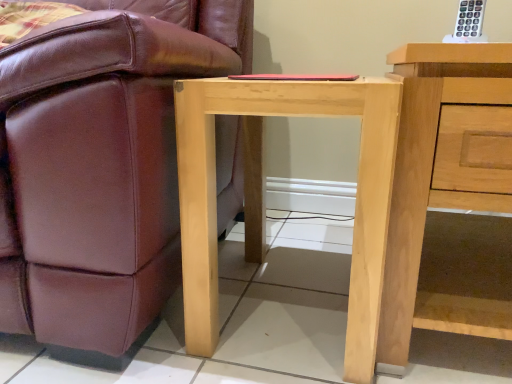
At what (x,y) coordinates should I click in order to perform the action: click on matte brown leather chair at lower left. Please return your answer as a coordinate pair (x, y). Image resolution: width=512 pixels, height=384 pixels. Looking at the image, I should click on (101, 168).

In the scene shown: Considering the relative positions of matte brown leather chair at lower left and natural wood table at center in the image provided, is matte brown leather chair at lower left to the left of natural wood table at center from the viewer's perspective?

Yes.

Considering the relative sizes of matte brown leather chair at lower left and natural wood table at center in the image provided, is matte brown leather chair at lower left bigger than natural wood table at center?

Indeed, matte brown leather chair at lower left has a larger size compared to natural wood table at center.

Is natural wood table at center inside matte brown leather chair at lower left?

No, matte brown leather chair at lower left does not contain natural wood table at center.

Locate an element on the screen. chair above the natural wood table at center (from a real-world perspective) is located at coordinates (101, 168).

Is matte brown leather chair at lower left in contact with natural wood nightstand at right?

They are not placed beside each other.

Is matte brown leather chair at lower left aimed at natural wood nightstand at right?

No, matte brown leather chair at lower left does not turn towards natural wood nightstand at right.

Can natural wood nightstand at right be found inside matte brown leather chair at lower left?

Actually, natural wood nightstand at right is outside matte brown leather chair at lower left.

Between matte brown leather chair at lower left and natural wood nightstand at right, which one has smaller size?

natural wood nightstand at right.

Considering the relative sizes of natural wood table at center and matte brown leather chair at lower left in the image provided, is natural wood table at center taller than matte brown leather chair at lower left?

Incorrect, the height of natural wood table at center is not larger of that of matte brown leather chair at lower left.

From a real-world perspective, is natural wood table at center positioned over matte brown leather chair at lower left based on gravity?

Incorrect, from a real-world perspective, natural wood table at center is lower than matte brown leather chair at lower left.

Can you confirm if natural wood table at center is positioned to the left of matte brown leather chair at lower left?

In fact, natural wood table at center is to the right of matte brown leather chair at lower left.

The image size is (512, 384). In order to click on desk that appears below the matte brown leather chair at lower left (from a real-world perspective) in this screenshot , I will do `click(262, 195)`.

What's the angular difference between natural wood nightstand at right and natural wood table at center's facing directions?

The angle between the facing direction of natural wood nightstand at right and the facing direction of natural wood table at center is 1.08 degrees.

Which point is more forward, [388,301] or [192,120]?

The point [192,120] is closer to the camera.

Is natural wood nightstand at right spatially inside natural wood table at center, or outside of it?

natural wood nightstand at right is not inside natural wood table at center, it's outside.

Is natural wood nightstand at right positioned with its back to natural wood table at center?

No, natural wood table at center is not at the back of natural wood nightstand at right.

Does natural wood table at center have a greater width compared to natural wood nightstand at right?

No, natural wood table at center is not wider than natural wood nightstand at right.

Which is farther, (x=198, y=81) or (x=428, y=169)?

The point (x=198, y=81) is farther.

In terms of size, does natural wood table at center appear bigger or smaller than natural wood nightstand at right?

In the image, natural wood table at center appears to be smaller than natural wood nightstand at right.

From the image's perspective, which is below, natural wood table at center or natural wood nightstand at right?

From the image's view, natural wood table at center is below.

Does point (406, 203) come farther from viewer compared to point (93, 338)?

No, (406, 203) is closer to viewer.

Is natural wood nightstand at right not close to matte brown leather chair at lower left?

No, natural wood nightstand at right is in close proximity to matte brown leather chair at lower left.

Who is taller, natural wood nightstand at right or matte brown leather chair at lower left?

matte brown leather chair at lower left is taller.

Which is in front, natural wood nightstand at right or matte brown leather chair at lower left?

Positioned in front is matte brown leather chair at lower left.

Find the location of a particular element. The image size is (512, 384). chair on the left of natural wood table at center is located at coordinates (101, 168).

Where is `chair that appears in front of the natural wood nightstand at right`? The image size is (512, 384). chair that appears in front of the natural wood nightstand at right is located at coordinates (101, 168).

Looking at the image, which one is located closer to natural wood table at center, natural wood nightstand at right or matte brown leather chair at lower left?

natural wood nightstand at right is positioned closer to the anchor natural wood table at center.

Which object lies nearer to the anchor point matte brown leather chair at lower left, natural wood nightstand at right or natural wood table at center?

Among the two, natural wood table at center is located nearer to matte brown leather chair at lower left.

Based on their spatial positions, is natural wood table at center or matte brown leather chair at lower left closer to natural wood nightstand at right?

The object closer to natural wood nightstand at right is natural wood table at center.

In the scene shown: Based on their spatial positions, is matte brown leather chair at lower left or natural wood nightstand at right further from natural wood table at center?

matte brown leather chair at lower left is further to natural wood table at center.

Based on their spatial positions, is matte brown leather chair at lower left or natural wood table at center further from natural wood nightstand at right?

Based on the image, matte brown leather chair at lower left appears to be further to natural wood nightstand at right.

Which object lies nearer to the anchor point matte brown leather chair at lower left, natural wood table at center or natural wood nightstand at right?

Among the two, natural wood table at center is located nearer to matte brown leather chair at lower left.

In order to click on desk between matte brown leather chair at lower left and natural wood nightstand at right from left to right in this screenshot , I will do `click(262, 195)`.